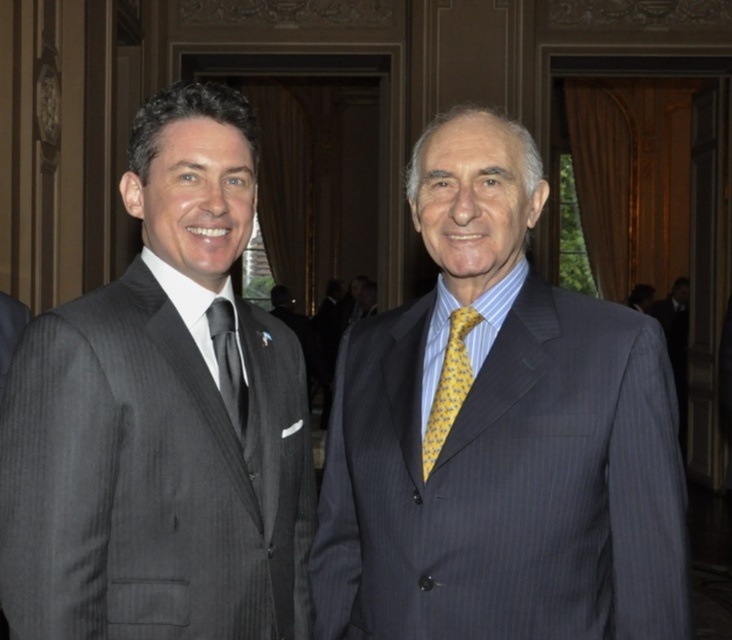
Question: Is matte black suit at left positioned before gray pinstripe suit at left?

Choices:
 (A) no
 (B) yes

Answer: (B)

Question: Which point is farther to the camera?

Choices:
 (A) (212, 348)
 (B) (3, 376)
 (C) (458, 454)
 (D) (198, 243)

Answer: (B)

Question: Which object is the closest to the matte gray suit at center?

Choices:
 (A) matte gray tie at left
 (B) matte black suit at left

Answer: (B)

Question: Considering the real-world distances, which object is farthest from the matte gray tie at left?

Choices:
 (A) matte black suit at left
 (B) matte gray suit at center
 (C) yellow printed silk tie at center

Answer: (B)

Question: Observing the image, what is the correct spatial positioning of yellow printed silk tie at center in reference to matte gray tie at left?

Choices:
 (A) right
 (B) left

Answer: (A)

Question: Does matte gray suit at center have a greater width compared to yellow printed silk tie at center?

Choices:
 (A) yes
 (B) no

Answer: (A)